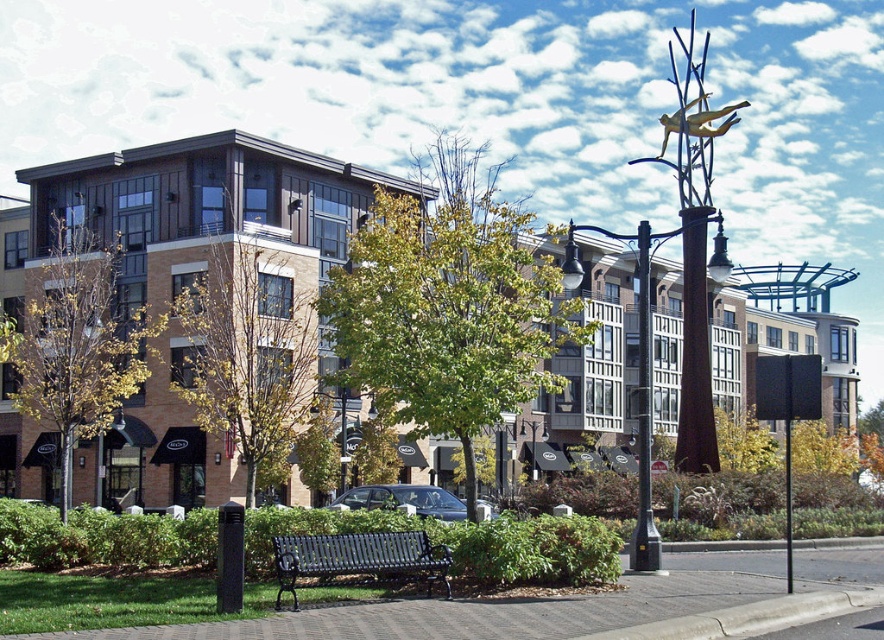
The height and width of the screenshot is (640, 884). Find the location of `brick pavement at center`. brick pavement at center is located at coordinates (504, 609).

Where is `brick pavement at center`? brick pavement at center is located at coordinates (504, 609).

Who is lower down, bronze textured pole at center or black metal bench at center?

black metal bench at center is below.

Is point (646, 330) in front of point (326, 552)?

No, (646, 330) is further to viewer.

The width and height of the screenshot is (884, 640). I want to click on bronze textured pole at center, so click(x=682, y=358).

Which is more to the right, green leafy tree at center or brick pavement at center?

brick pavement at center

Does green leafy tree at center appear under brick pavement at center?

Incorrect, green leafy tree at center is not positioned below brick pavement at center.

Between point (516, 412) and point (668, 582), which one is positioned behind?

The point (516, 412) is more distant.

You are a GUI agent. You are given a task and a screenshot of the screen. Output one action in this format:
    pyautogui.click(x=<x>, y=<y>)
    Task: Click on the green leafy tree at center
    This screenshot has height=640, width=884.
    Given the screenshot: What is the action you would take?
    pos(448,307)